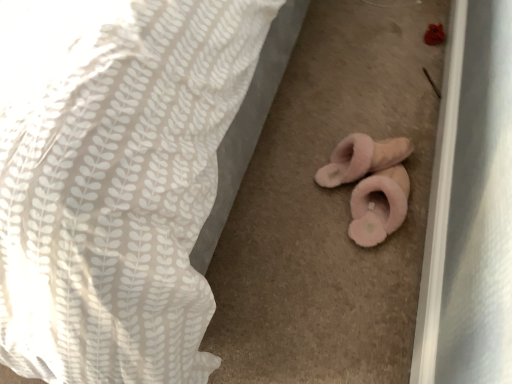
Question: Considering the positions of pink fluffy slippers at lower center and white textured fabric at center in the image, is pink fluffy slippers at lower center taller or shorter than white textured fabric at center?

Choices:
 (A) short
 (B) tall

Answer: (A)

Question: Is pink fluffy slippers at lower center wider or thinner than white textured fabric at center?

Choices:
 (A) thin
 (B) wide

Answer: (A)

Question: From a real-world perspective, is pink fluffy slippers at lower center above or below white textured fabric at center?

Choices:
 (A) below
 (B) above

Answer: (A)

Question: In terms of height, does white textured fabric at center look taller or shorter compared to pink fluffy slippers at lower center?

Choices:
 (A) short
 (B) tall

Answer: (B)

Question: Do you think white textured fabric at center is within pink fluffy slippers at lower center, or outside of it?

Choices:
 (A) outside
 (B) inside

Answer: (A)

Question: From a real-world perspective, is white textured fabric at center positioned above or below pink fluffy slippers at lower center?

Choices:
 (A) below
 (B) above

Answer: (B)

Question: Considering the relative positions of white textured fabric at center and pink fluffy slippers at lower center in the image provided, is white textured fabric at center to the left or to the right of pink fluffy slippers at lower center?

Choices:
 (A) right
 (B) left

Answer: (B)